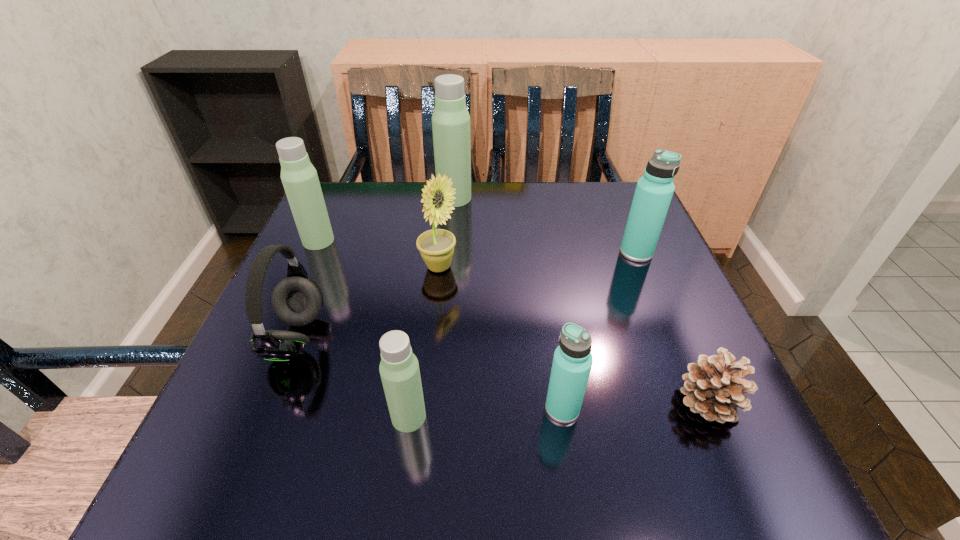
This screenshot has height=540, width=960. I want to click on free space located 0.370m on the back of the pinecone, so click(x=638, y=240).

Identify the location of thermos bottle present at the near edge. (399, 369).

Find the location of `pinecone that is positioned at the near edge`. pinecone that is positioned at the near edge is located at coordinates (714, 387).

The height and width of the screenshot is (540, 960). In order to click on thermos bottle present at the left edge in this screenshot , I will do `click(299, 177)`.

The image size is (960, 540). I want to click on headset at the left edge, so click(x=297, y=300).

You are a GUI agent. You are given a task and a screenshot of the screen. Output one action in this format:
    pyautogui.click(x=<x>, y=<y>)
    Task: Click on the thermos bottle positioned at the right edge
    The image size is (960, 540).
    Given the screenshot: What is the action you would take?
    pyautogui.click(x=654, y=191)

The height and width of the screenshot is (540, 960). I want to click on pinecone located at the right edge, so click(714, 387).

Identify the location of object that is at the far left corner. (299, 177).

You are a GUI agent. You are given a task and a screenshot of the screen. Output one action in this format:
    pyautogui.click(x=<x>, y=<y>)
    Task: Click on the object located at the near right corner
    
    Given the screenshot: What is the action you would take?
    pyautogui.click(x=714, y=387)

Where is `vacant region at the far edge of the desktop`? The image size is (960, 540). vacant region at the far edge of the desktop is located at coordinates (500, 224).